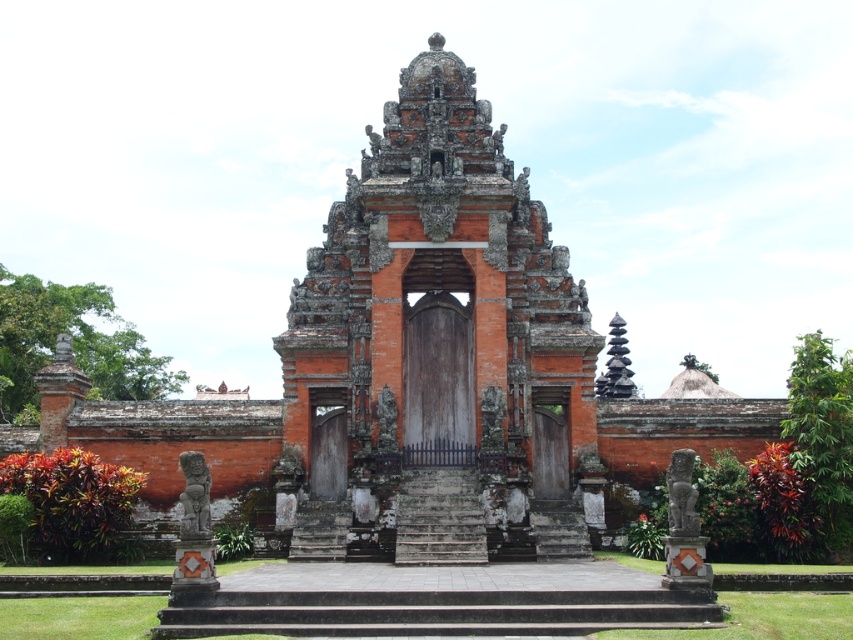
Question: Among these objects, which one is nearest to the camera?

Choices:
 (A) gray stone stairs at center
 (B) reddish-brown stone temple at center

Answer: (A)

Question: Is reddish-brown stone temple at center positioned in front of gray stone stairs at center?

Choices:
 (A) no
 (B) yes

Answer: (A)

Question: Can you confirm if reddish-brown stone temple at center is bigger than gray stone stairs at center?

Choices:
 (A) no
 (B) yes

Answer: (B)

Question: Among these points, which one is nearest to the camera?

Choices:
 (A) (469, 557)
 (B) (335, 538)

Answer: (A)

Question: Does reddish-brown stone temple at center lie behind gray stone stairs at center?

Choices:
 (A) no
 (B) yes

Answer: (B)